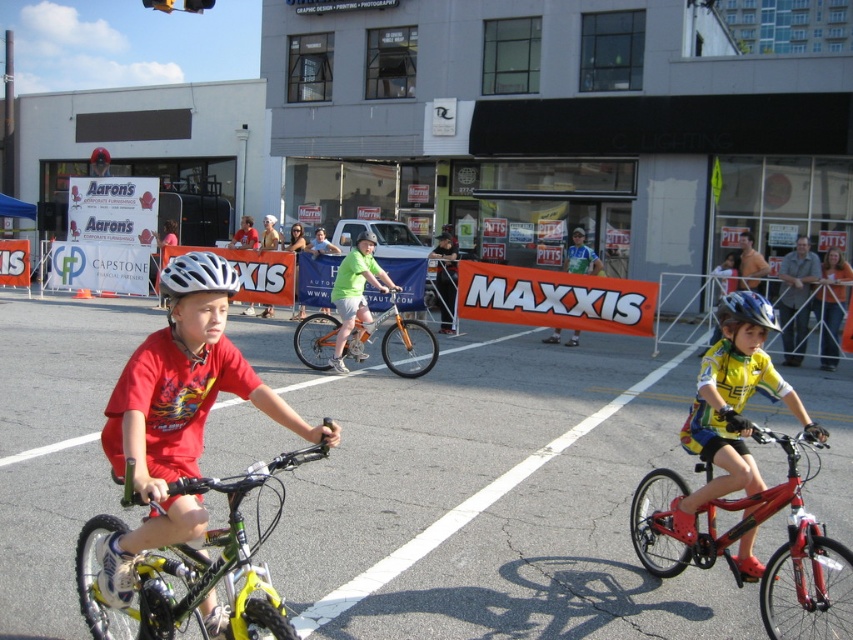
Can you confirm if yellow-green matte bicycle at center is positioned to the right of yellow jersey cyclist at center?

Incorrect, yellow-green matte bicycle at center is not on the right side of yellow jersey cyclist at center.

Does point (204, 636) lie in front of point (740, 337)?

That is True.

The image size is (853, 640). What do you see at coordinates (195, 566) in the screenshot?
I see `yellow-green matte bicycle at center` at bounding box center [195, 566].

Where is `yellow-green matte bicycle at center`? The image size is (853, 640). yellow-green matte bicycle at center is located at coordinates (195, 566).

Measure the distance between yellow-green matte bicycle at center and camera.

They are 9.16 feet apart.

Is yellow-green matte bicycle at center in front of green matte bicycle at center?

Yes, it is.

This screenshot has width=853, height=640. I want to click on yellow-green matte bicycle at center, so click(x=195, y=566).

Which is below, white matte bicycle helmet at center or blue matte bicycle helmet at center?

blue matte bicycle helmet at center is lower down.

Identify the location of white matte bicycle helmet at center. This screenshot has width=853, height=640. (196, 275).

This screenshot has height=640, width=853. I want to click on white matte bicycle helmet at center, so click(x=196, y=275).